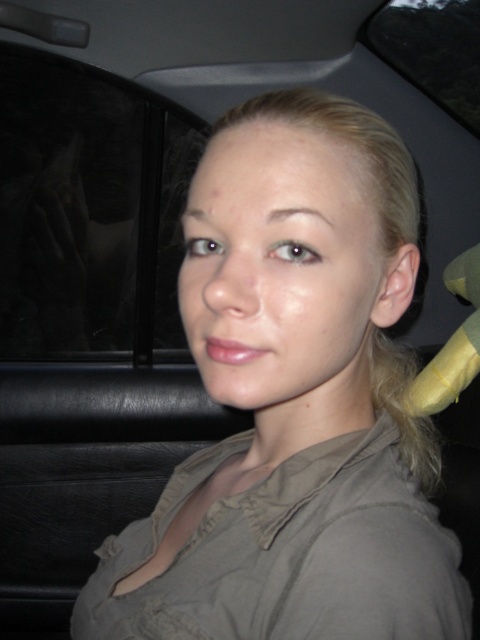
From the picture: Who is positioned more to the right, transparent glass at left or transparent glass window at upper center?

Positioned to the right is transparent glass window at upper center.

Image resolution: width=480 pixels, height=640 pixels. Describe the element at coordinates (90, 212) in the screenshot. I see `transparent glass at left` at that location.

Find the location of a particular element. The width and height of the screenshot is (480, 640). transparent glass at left is located at coordinates (90, 212).